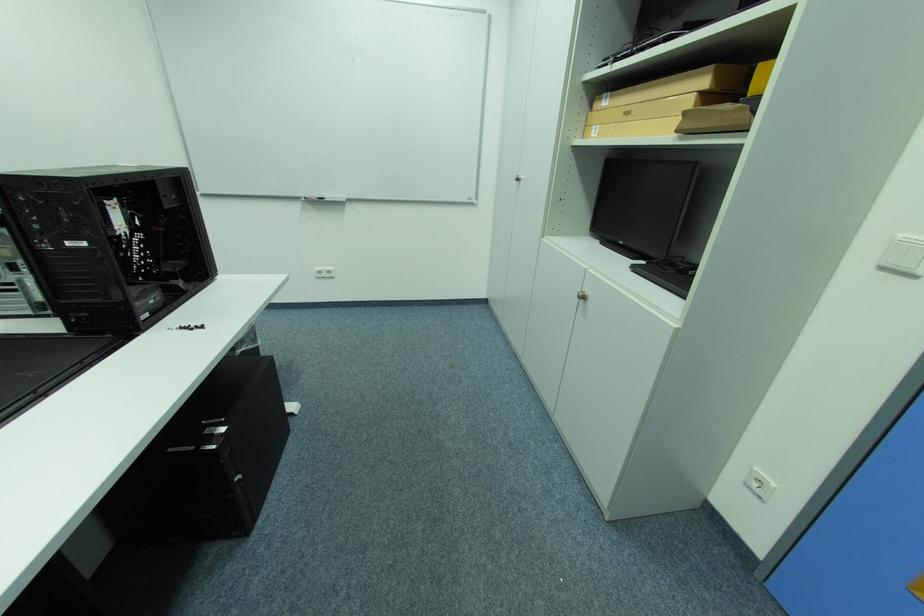
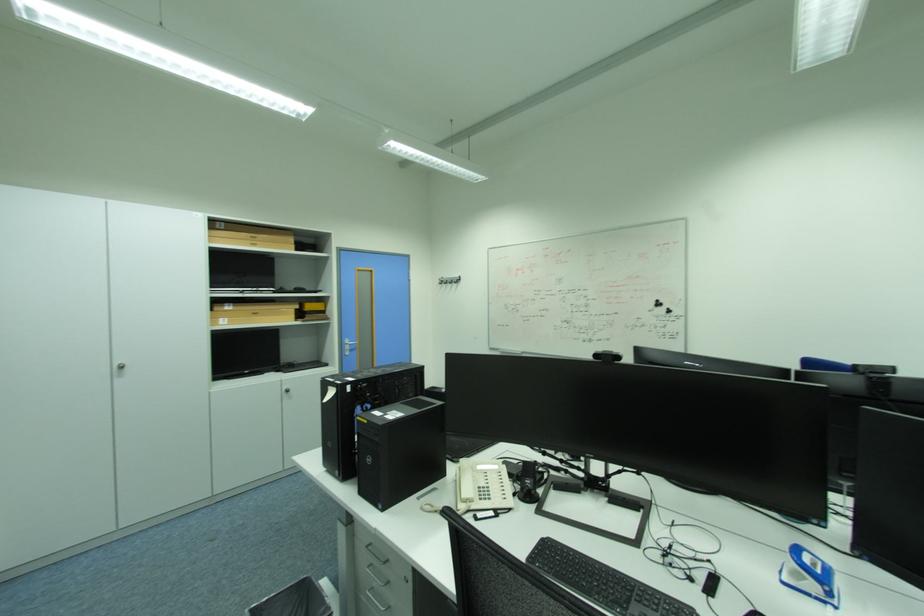
The point at (602, 128) is marked in the first image. Where is the corresponding point in the second image?

(228, 320)